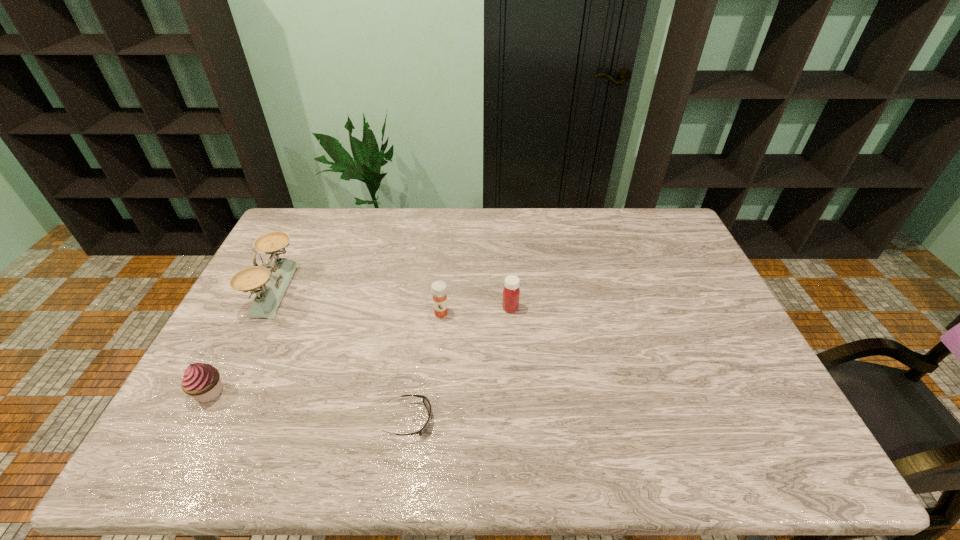
At what (x,y) coordinates should I click in order to perform the action: click on vacant area in the image that satisfies the following two spatial constraints: 1. on the label side of the left medicine; 2. on the lenses of the goggles. Please return your answer as a coordinate pair (x, y). This screenshot has width=960, height=540. Looking at the image, I should click on (431, 420).

Locate an element on the screen. This screenshot has height=540, width=960. vacant space that satisfies the following two spatial constraints: 1. on the label side of the left medicine; 2. on the lenses of the goggles is located at coordinates (431, 420).

Locate an element on the screen. vacant point that satisfies the following two spatial constraints: 1. on the label side of the left medicine; 2. on the lenses of the shortest object is located at coordinates (431, 420).

Identify the location of free point that satisfies the following two spatial constraints: 1. on the back side of the right medicine; 2. on the right side of the cupcake. This screenshot has height=540, width=960. (253, 308).